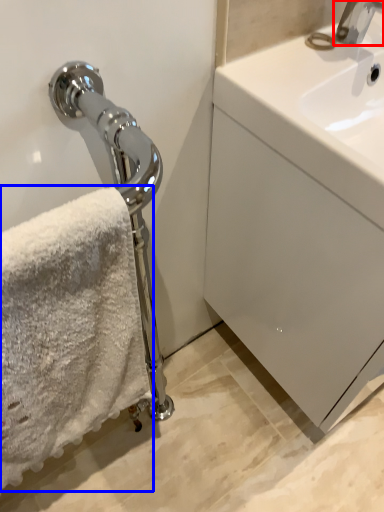
Question: Which object appears farthest to the camera in this image, tap (highlighted by a red box) or towel (highlighted by a blue box)?

Choices:
 (A) tap
 (B) towel

Answer: (A)